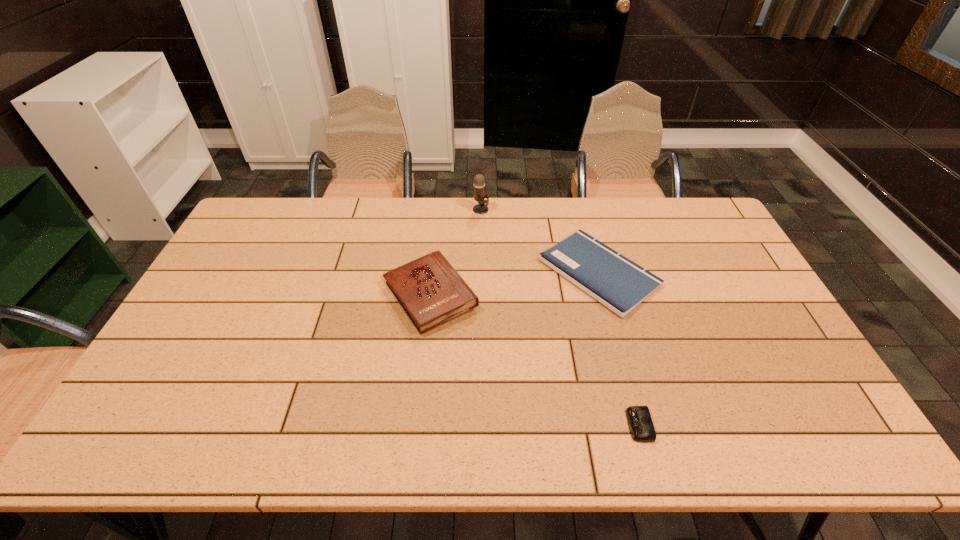
Image resolution: width=960 pixels, height=540 pixels. Identify the location of the tallest object. (479, 181).

Where is `the farthest object`? The height and width of the screenshot is (540, 960). the farthest object is located at coordinates (479, 181).

Identify the location of the third shortest object. (431, 292).

Image resolution: width=960 pixels, height=540 pixels. I want to click on paperback book, so click(615, 281).

The image size is (960, 540). In order to click on the shortest object in this screenshot , I will do `click(641, 426)`.

This screenshot has height=540, width=960. Find the location of `the nearest object`. the nearest object is located at coordinates (641, 426).

I want to click on vacant space positioned on the right of the microphone, so click(588, 210).

You are a GUI agent. You are given a task and a screenshot of the screen. Output one action in this format:
    pyautogui.click(x=<x>, y=<y>)
    Task: Click on the free region located 0.250m on the right of the third shortest object
    Image resolution: width=960 pixels, height=540 pixels.
    Given the screenshot: What is the action you would take?
    pyautogui.click(x=562, y=295)

Locate an element on the screen. free space located on the left of the paperback book is located at coordinates (518, 272).

At what (x,y) coordinates should I click in order to perform the action: click on free point located on the display of the nearest object. Please return your answer as a coordinate pair (x, y). The width and height of the screenshot is (960, 540). Looking at the image, I should click on pos(485,425).